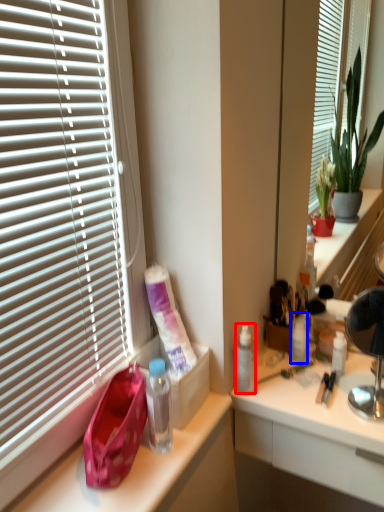
Question: Which object is further to the camera taking this photo, bottle (highlighted by a red box) or toiletry (highlighted by a blue box)?

Choices:
 (A) bottle
 (B) toiletry

Answer: (B)